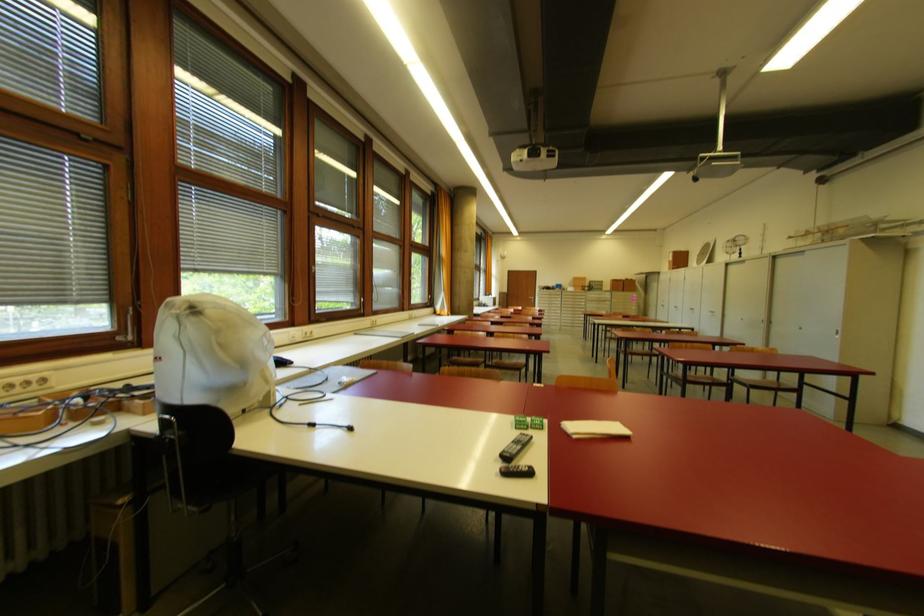
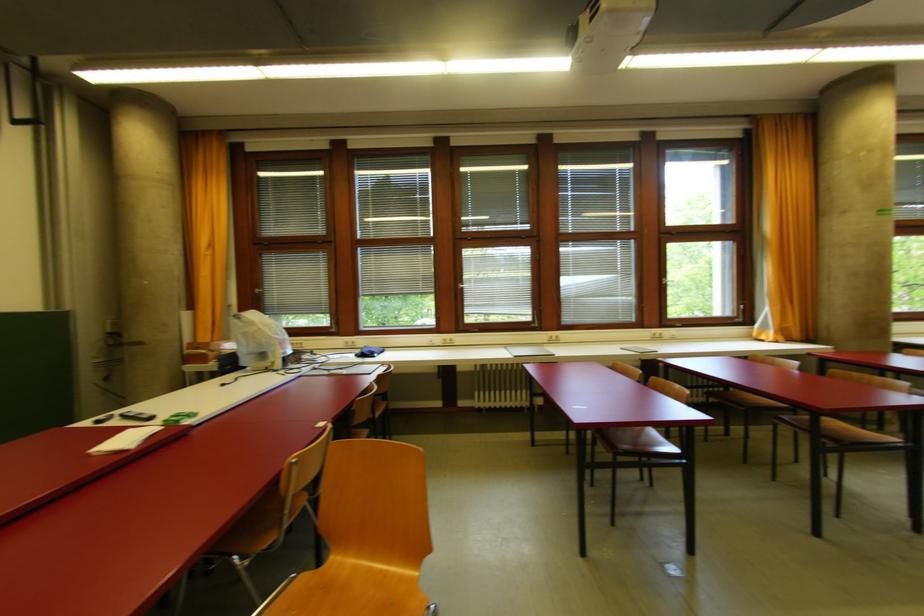
Locate, in the second image, the point that corresponds to point 377,323 in the first image.

(556, 339)